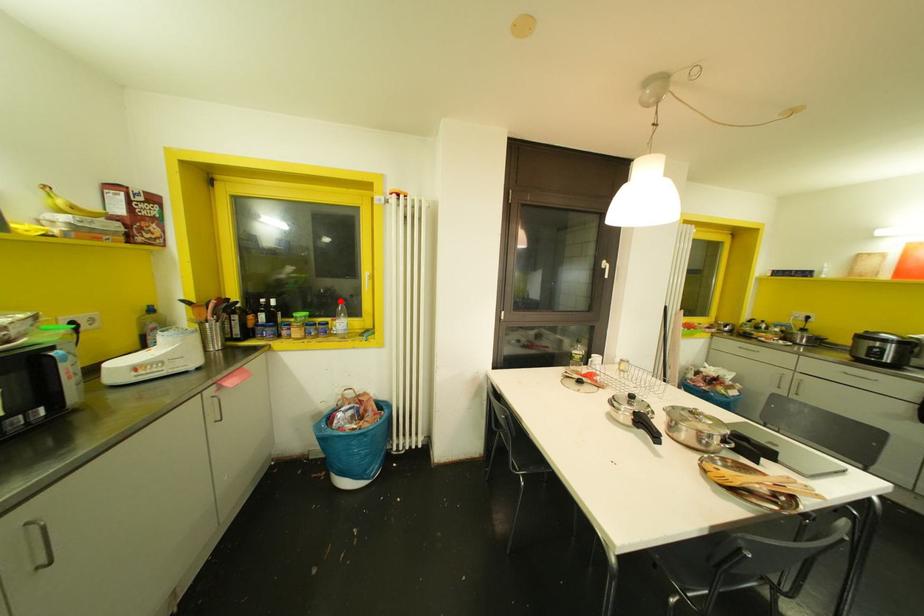
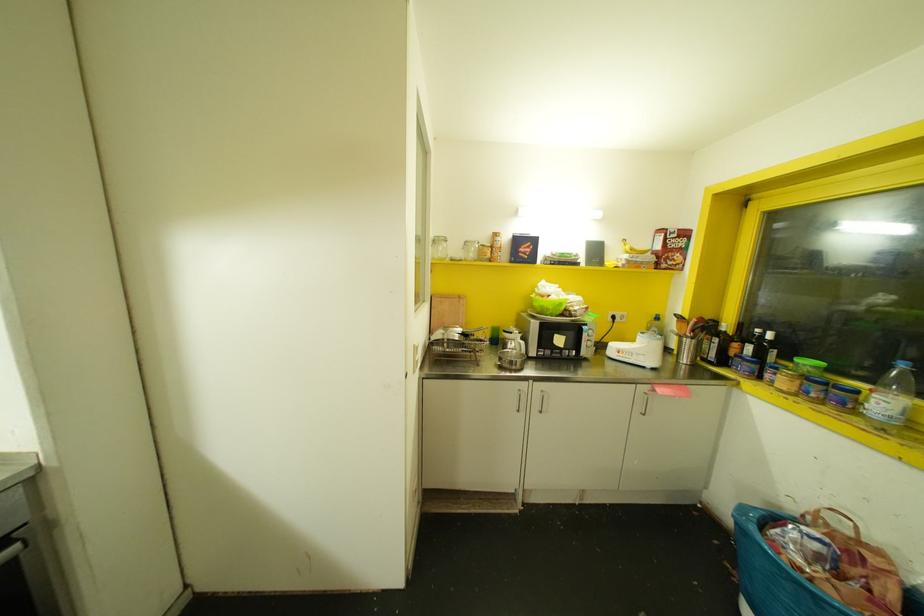
Question: I am providing you with two images of the same scene from different viewpoints. In image1, a red point is highlighted. Considering the same 3D point in image2, which of the following is correct?

Choices:
 (A) It is closer
 (B) It is farther

Answer: (B)